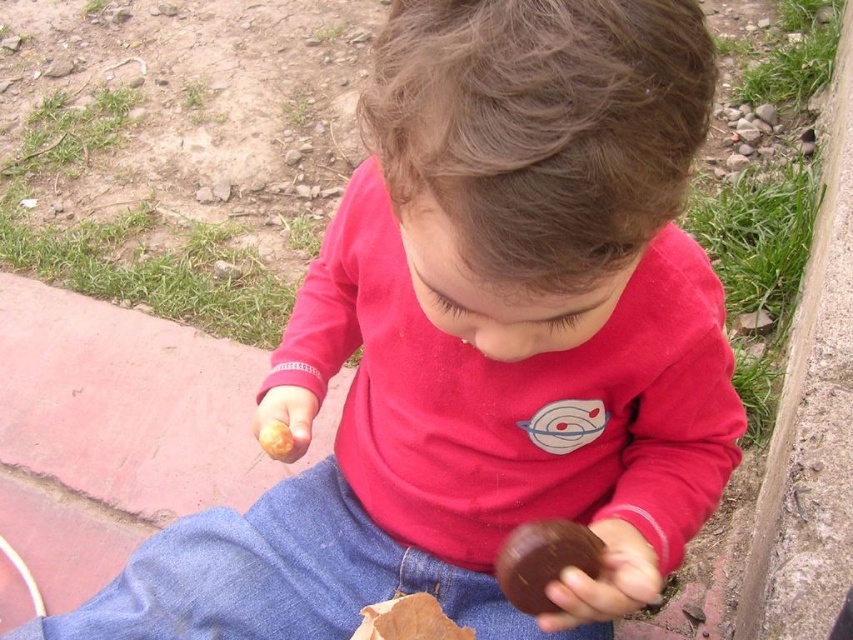
The child is holding a brown wooden ball at center and a yellow matte food at center. Which object is bigger?

The brown wooden ball at center is larger in size than the yellow matte food at center.

You are a parent trying to ensure your child doesn not choke on small objects. You see your child holding a brown wooden ball at center and a yellow matte food at center. Which object is closer to the child s face?

The brown wooden ball at center is in front of the yellow matte food at center, so it is closer to the child s face.